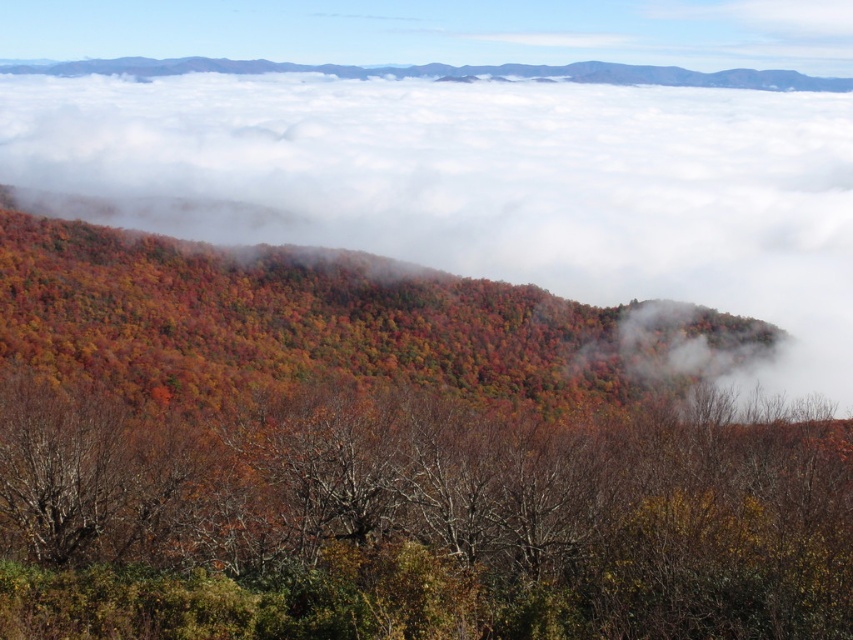
Does brown matte tree at center have a smaller size compared to white fluffy cloud at upper center?

Yes, brown matte tree at center is smaller than white fluffy cloud at upper center.

Can you confirm if brown matte tree at center is positioned to the left of white fluffy cloud at upper center?

Yes, brown matte tree at center is to the left of white fluffy cloud at upper center.

Locate an element on the screen. brown matte tree at center is located at coordinates (421, 522).

Locate an element on the screen. This screenshot has height=640, width=853. brown matte tree at center is located at coordinates (421, 522).